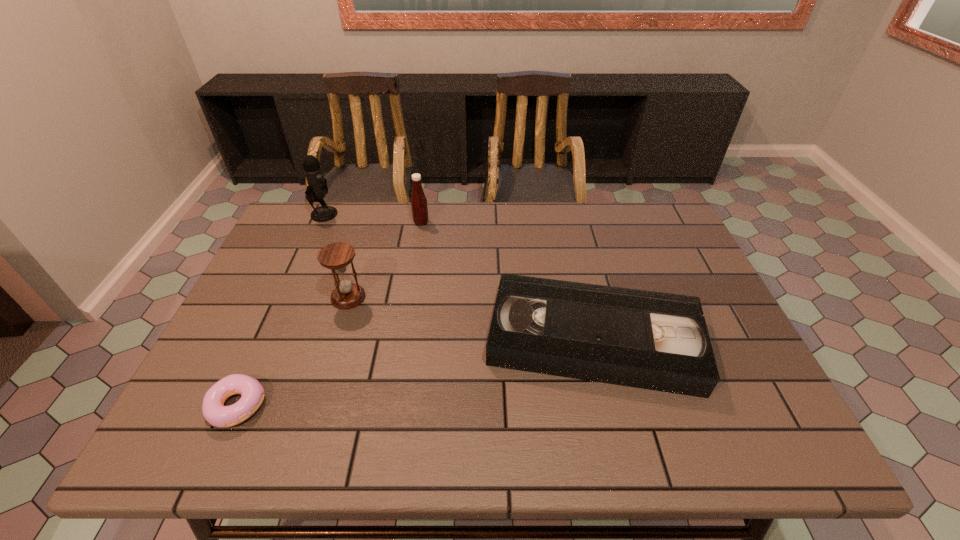
You are a GUI agent. You are given a task and a screenshot of the screen. Output one action in this format:
    pyautogui.click(x=<x>, y=<y>)
    Task: Click on the free space located 0.330m on the back of the shortest object
    The width and height of the screenshot is (960, 540).
    Given the screenshot: What is the action you would take?
    pyautogui.click(x=293, y=281)

Where is `microphone located in the far edge section of the desktop`? Image resolution: width=960 pixels, height=540 pixels. microphone located in the far edge section of the desktop is located at coordinates (317, 188).

At what (x,y) coordinates should I click in order to perform the action: click on Tabasco sauce that is at the far edge. Please return your answer as a coordinate pair (x, y). Looking at the image, I should click on (419, 206).

Locate an element on the screen. object that is at the near edge is located at coordinates (213, 409).

Locate an element on the screen. Image resolution: width=960 pixels, height=540 pixels. microphone located at the left edge is located at coordinates (317, 188).

Locate an element on the screen. The height and width of the screenshot is (540, 960). doughnut located at the left edge is located at coordinates (213, 409).

Where is `object located at the right edge`? This screenshot has height=540, width=960. object located at the right edge is located at coordinates (659, 341).

Locate an element on the screen. The height and width of the screenshot is (540, 960). object that is at the far left corner is located at coordinates (317, 188).

Find the location of a particular element. Image resolution: width=960 pixels, height=540 pixels. object positioned at the near left corner is located at coordinates (213, 409).

Find the location of a particular element. free space at the far edge of the desktop is located at coordinates (409, 243).